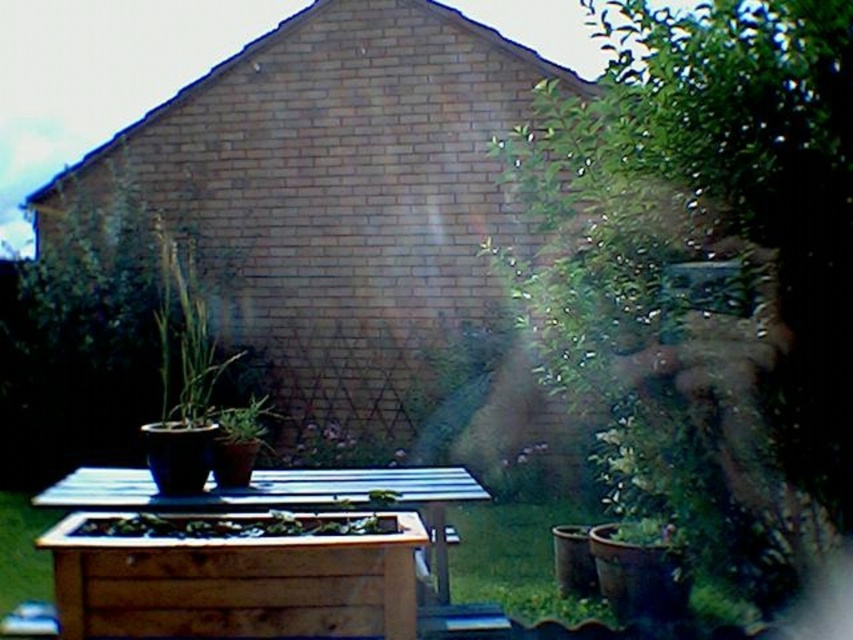
You are a gardener who wants to place a new small statue that requires a stable, flat surface. You see the wooden planter at lower center and the wooden planter at center. Which one has a higher elevation and is more suitable for placing the statue?

The wooden planter at center has a greater height compared to the wooden planter at lower center, making it more elevated and suitable for placing the statue.

You are a gardener who needs to water both wooden planters. The watering can you are holding has a 20 inch long handle. If you stand at the edge of the wooden planter at lower center, can you reach the wooden planter at center without moving your feet?

The wooden planter at lower center is 18.91 inches away from the wooden planter at center. Since the watering can has a 20 inch handle, which is longer than the distance between them, you can reach the wooden planter at center from the wooden planter at lower center without moving your feet.

You are standing in the garden and want to place a small statue on the wooden planter at lower center. According to the coordinates provided, where exactly should you place the statue?

The wooden planter at lower center is located at coordinates point (234, 582), so you should place the statue there.